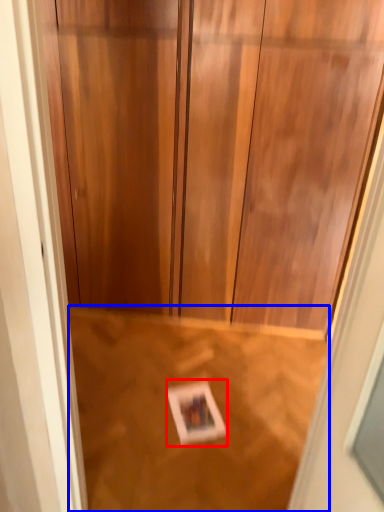
Question: Which object appears farthest to the camera in this image, postcard (highlighted by a red box) or plywood (highlighted by a blue box)?

Choices:
 (A) postcard
 (B) plywood

Answer: (A)